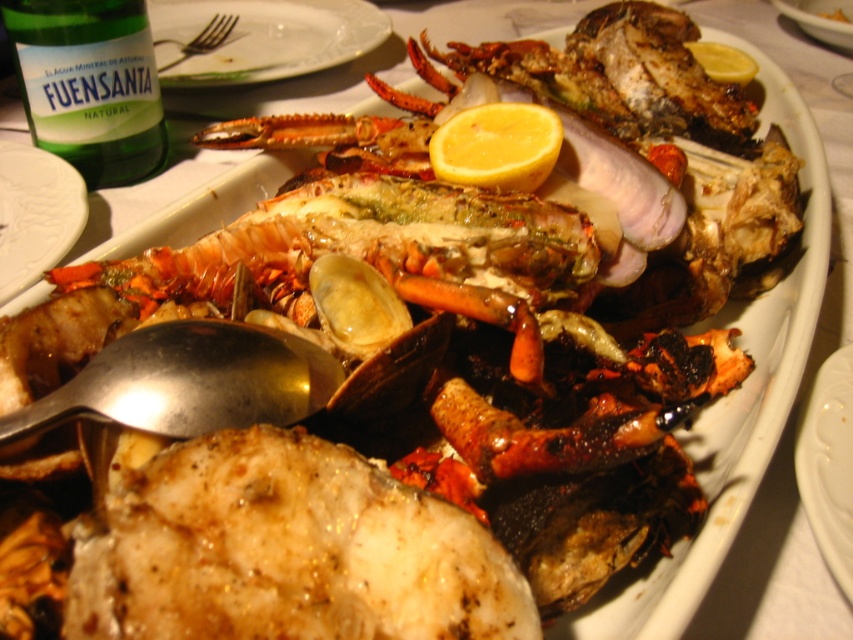
Looking at this image, is green glass bottle at upper left positioned at the back of yellow smooth lemon at upper right?

No, green glass bottle at upper left is in front of yellow smooth lemon at upper right.

Which is more to the right, green glass bottle at upper left or yellow smooth lemon at upper right?

yellow smooth lemon at upper right

Who is more forward, (97, 179) or (728, 64)?

Point (97, 179) is more forward.

You are a GUI agent. You are given a task and a screenshot of the screen. Output one action in this format:
    pyautogui.click(x=<x>, y=<y>)
    Task: Click on the green glass bottle at upper left
    This screenshot has width=853, height=640.
    Given the screenshot: What is the action you would take?
    pyautogui.click(x=90, y=84)

Is white ceramic plate at upper left positioned at the back of yellow smooth lemon at center?

Yes, it is.

Based on the photo, who is more forward, (48, 259) or (503, 104)?

Point (503, 104) is more forward.

Identify the location of white ceramic plate at upper left. (35, 214).

Is point (801, 422) less distant than point (486, 164)?

Yes.

Describe the element at coordinates (828, 464) in the screenshot. I see `white glossy plate at center` at that location.

The height and width of the screenshot is (640, 853). In order to click on white glossy plate at center in this screenshot , I will do `click(828, 464)`.